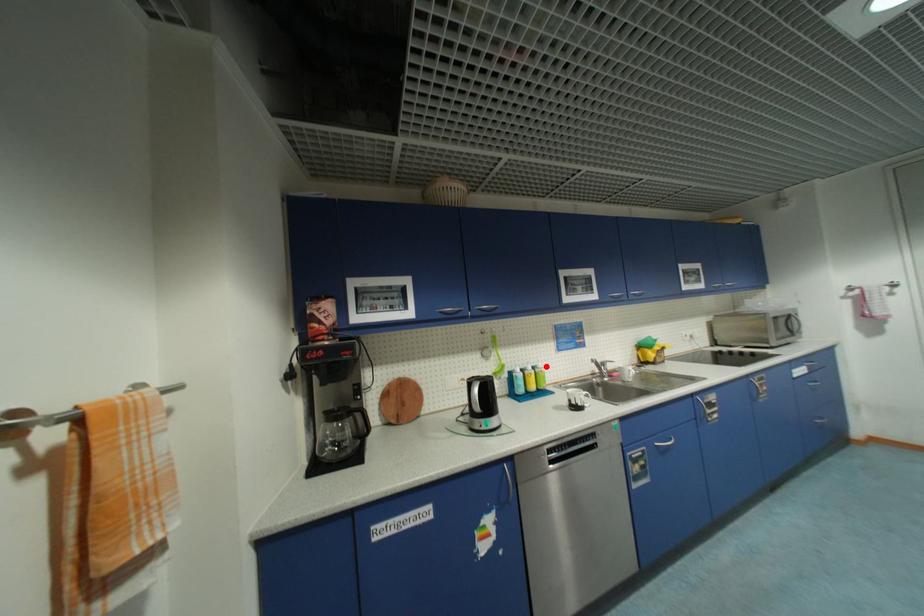
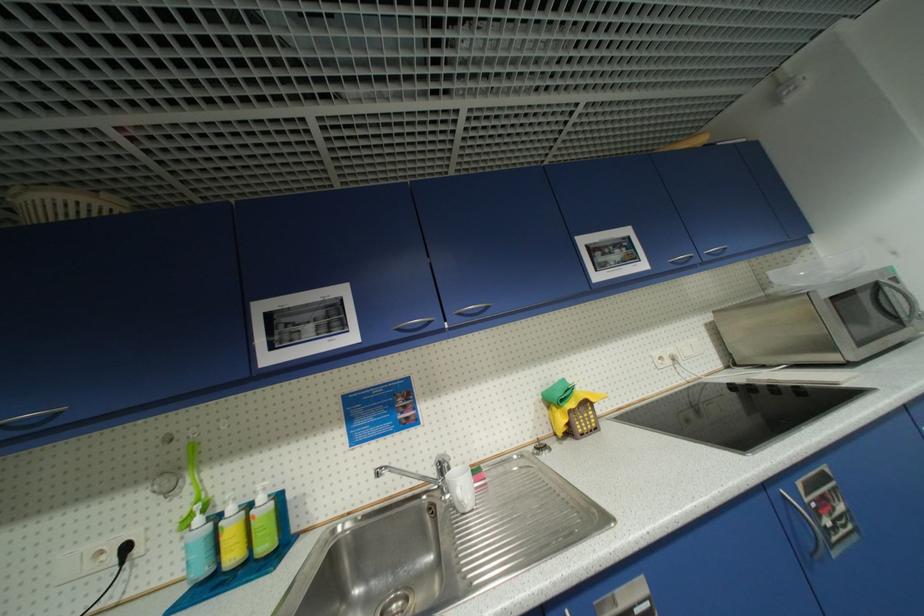
Question: I am providing you with two images of the same scene from different viewpoints. In image1, a red point is highlighted. Considering the same 3D point in image2, which of the following is correct?

Choices:
 (A) It is closer
 (B) It is farther

Answer: (A)